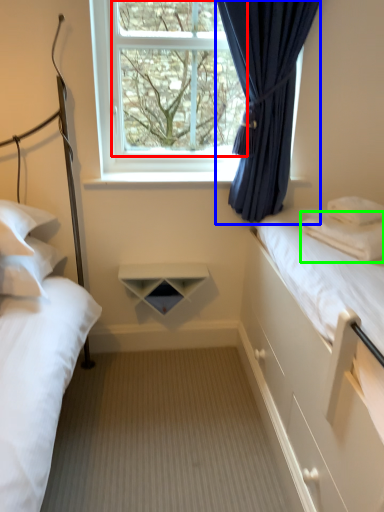
Question: Which object is positioned farthest from window screen (highlighted by a red box)? Select from curtain (highlighted by a blue box) and pillow (highlighted by a green box).

Choices:
 (A) curtain
 (B) pillow

Answer: (B)